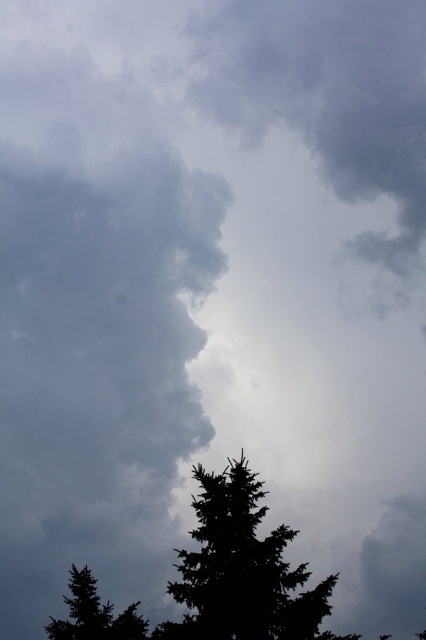
Which is in front, point (226, 536) or point (108, 627)?

Point (226, 536) is in front.

Which of these two, black matte tree at center or green matte tree at lower left, stands shorter?

Standing shorter between the two is green matte tree at lower left.

What do you see at coordinates (241, 570) in the screenshot? I see `black matte tree at center` at bounding box center [241, 570].

The width and height of the screenshot is (426, 640). Identify the location of black matte tree at center. coord(241,570).